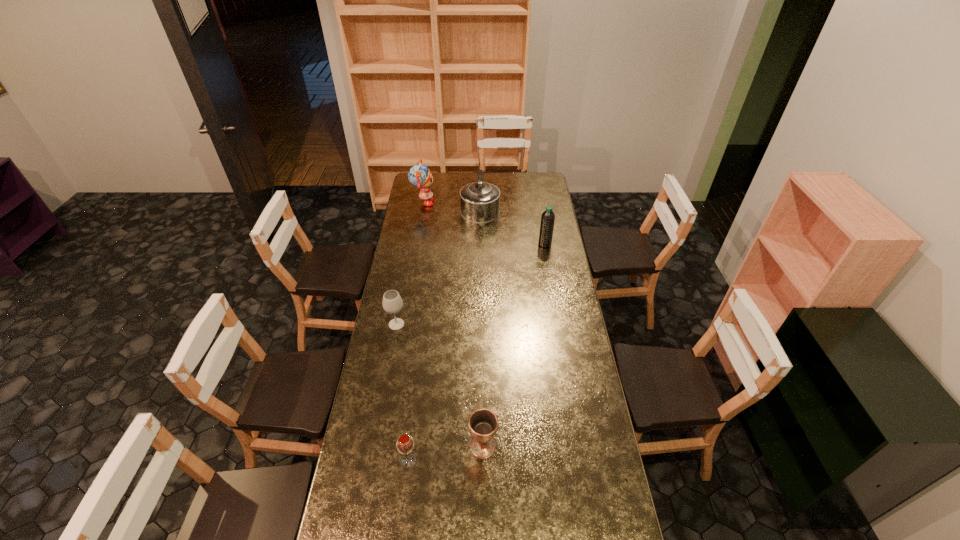
Where is `vacant space situated on the face of the doll`? This screenshot has height=540, width=960. vacant space situated on the face of the doll is located at coordinates (466, 203).

Find the location of a particular element. This screenshot has width=960, height=540. vacant region located 0.230m on the front of the water bottle is located at coordinates (550, 277).

I want to click on vacant space positioned 0.130m on the right of the farther wineglass, so click(x=435, y=324).

The height and width of the screenshot is (540, 960). I want to click on blank area located on the front of the chalice, so click(484, 526).

Where is `vacant space situated on the right of the shorter wineglass`? The width and height of the screenshot is (960, 540). vacant space situated on the right of the shorter wineglass is located at coordinates (530, 461).

What are the coordinates of `doll at the left edge` in the screenshot? It's located at (419, 175).

Locate an element on the screen. The width and height of the screenshot is (960, 540). wineglass situated at the left edge is located at coordinates tap(392, 303).

The image size is (960, 540). What are the coordinates of `object that is at the right edge` in the screenshot? It's located at (548, 217).

Where is `blank space at the left edge of the desktop`? The image size is (960, 540). blank space at the left edge of the desktop is located at coordinates (417, 217).

Image resolution: width=960 pixels, height=540 pixels. Find the location of `vacant space at the right edge`. vacant space at the right edge is located at coordinates (582, 387).